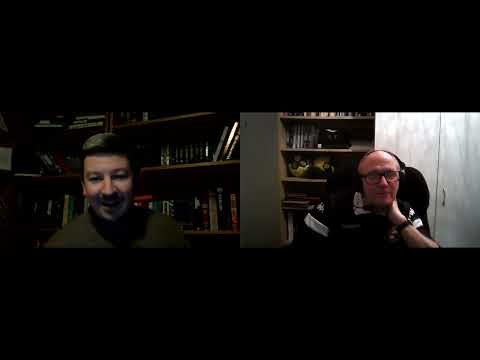
This screenshot has width=480, height=360. I want to click on wall, so click(x=267, y=160).